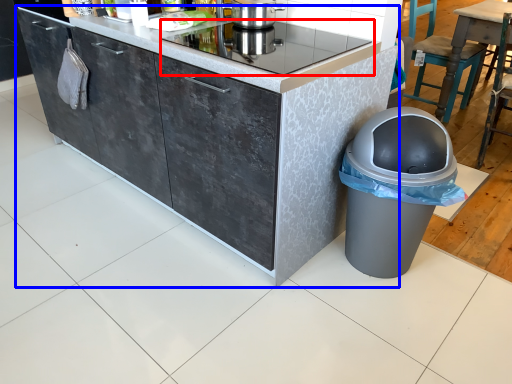
Question: Which point is closer to the camera, home appliance (highlighted by a red box) or cabinetry (highlighted by a blue box)?

Choices:
 (A) home appliance
 (B) cabinetry

Answer: (B)